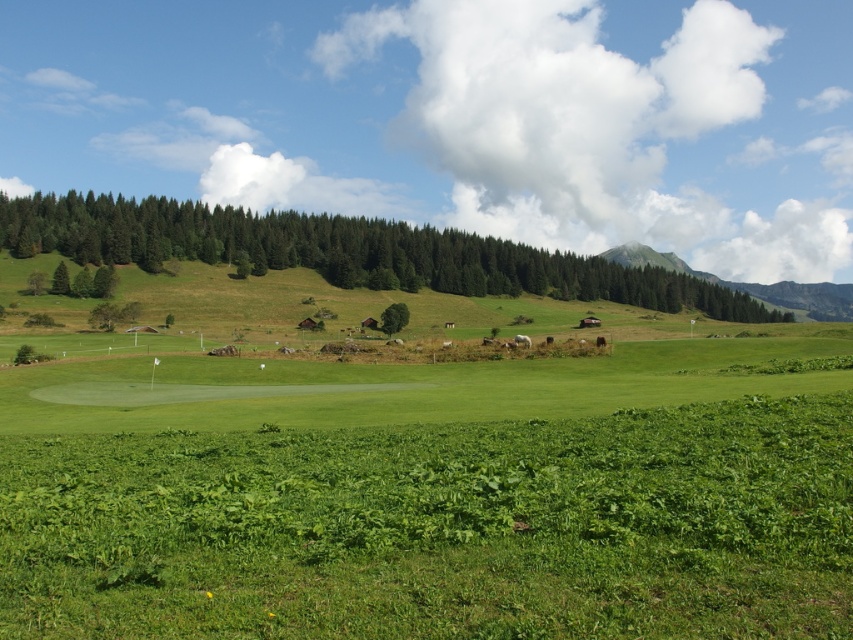
Which is below, green matte trees at upper left or green leafy tree at center?

green leafy tree at center

Is point (115, 259) in front of point (386, 333)?

No, (115, 259) is behind (386, 333).

Locate an element on the screen. The image size is (853, 640). green matte trees at upper left is located at coordinates (346, 252).

Consider the image. Who is positioned more to the right, green grassy mountain at upper center or green leafy tree at center?

green grassy mountain at upper center

Can you confirm if green grassy mountain at upper center is positioned to the right of green leafy tree at center?

Correct, you'll find green grassy mountain at upper center to the right of green leafy tree at center.

Is point (843, 294) closer to camera compared to point (396, 330)?

No.

Locate an element on the screen. This screenshot has height=640, width=853. green grassy mountain at upper center is located at coordinates (750, 284).

Is point (35, 243) in front of point (788, 280)?

Yes, point (35, 243) is in front of point (788, 280).

Between point (140, 257) and point (821, 285), which one is positioned in front?

Point (140, 257) is more forward.

Is point (157, 269) positioned behind point (833, 308)?

No.

This screenshot has width=853, height=640. What are the coordinates of `green matte trees at upper left` in the screenshot? It's located at (346, 252).